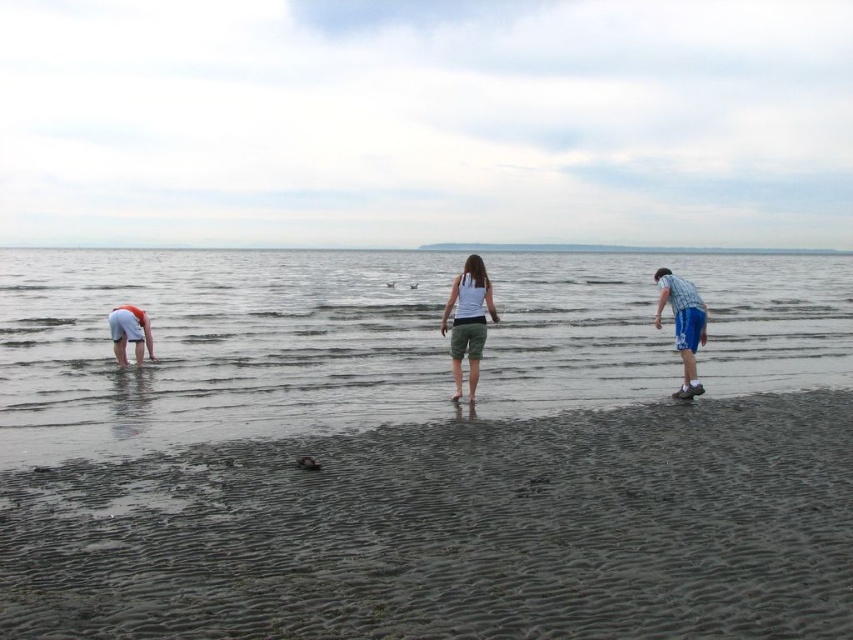
Question: Which object is the closest to the white cotton shorts at left?

Choices:
 (A) white cotton shirt at center
 (B) clear water at center
 (C) dark gray sand at lower center
 (D) white matte shorts at center

Answer: (D)

Question: Based on their relative distances, which object is farther from the white matte shorts at center?

Choices:
 (A) dark gray sand at lower center
 (B) white cotton shorts at left
 (C) white cotton shirt at center

Answer: (A)

Question: Is dark gray sand at lower center positioned at the back of white matte shorts at center?

Choices:
 (A) no
 (B) yes

Answer: (A)

Question: Which point is farther from the camera taking this photo?

Choices:
 (A) (51, 540)
 (B) (459, 397)
 (C) (672, 285)
 (D) (131, 438)

Answer: (C)

Question: Is dark gray sand at lower center below white matte shorts at center?

Choices:
 (A) no
 (B) yes

Answer: (B)

Question: Does white matte shorts at center appear on the right side of white cotton shorts at left?

Choices:
 (A) no
 (B) yes

Answer: (B)